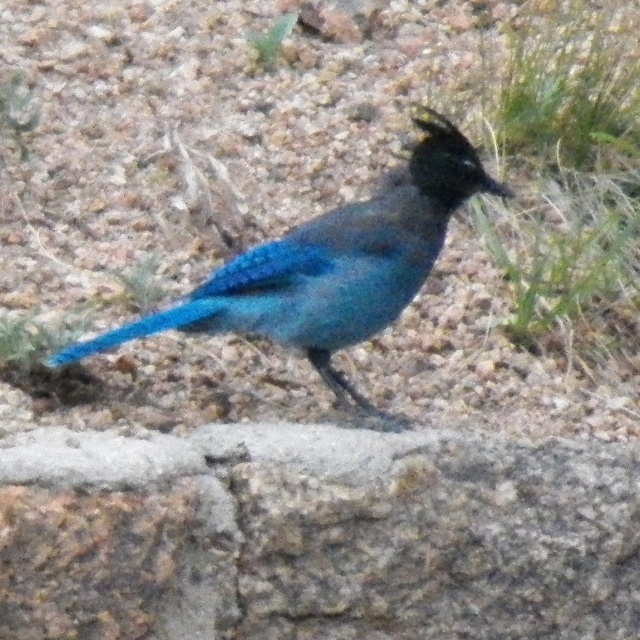
You are an ornithologist studying birds in a semi arid environment. You need to place a GPS tracker on the bird. The tracker must be placed at a specific coordinate point. Is the point at coordinate point (316, 536) on the bird or on the ground?

The point at coordinate point (316, 536) corresponds to granite rock at center, so it is on the ground, not on the bird.

You are a photographer aiming to capture the shiny blue bird at center in your shot. The granite rock at center is blocking part of the bird. Can you adjust your position to get a clear view of the bird without the rock?

The granite rock at center is below the shiny blue bird at center, so you can lower your camera angle or move to a higher position to avoid the rock and capture the bird clearly.

You are a small robot with a 30 cm wide arm. You need to reach the shiny blue bird at center without moving the granite rock at center. Is it possible for your arm to fit between them?

The distance between the granite rock at center and the shiny blue bird at center is 27.91 centimeters. Since your arm is 30 cm wide, it cannot fit between them because the space is narrower than the arm.